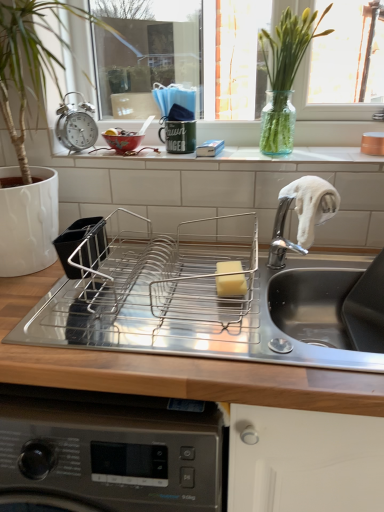
Question: Is there a large distance between matte ceramic bowl at upper left and metallic alarm clock at upper left?

Choices:
 (A) no
 (B) yes

Answer: (A)

Question: From the image's perspective, would you say matte ceramic bowl at upper left is shown under metallic alarm clock at upper left?

Choices:
 (A) yes
 (B) no

Answer: (A)

Question: From a real-world perspective, is matte ceramic bowl at upper left beneath metallic alarm clock at upper left?

Choices:
 (A) yes
 (B) no

Answer: (A)

Question: From the image's perspective, does matte ceramic bowl at upper left appear higher than metallic alarm clock at upper left?

Choices:
 (A) no
 (B) yes

Answer: (A)

Question: Is metallic alarm clock at upper left at the back of matte ceramic bowl at upper left?

Choices:
 (A) yes
 (B) no

Answer: (B)

Question: Is matte ceramic bowl at upper left at the left side of metallic alarm clock at upper left?

Choices:
 (A) yes
 (B) no

Answer: (B)

Question: From a real-world perspective, is yellow sponge at center physically above white ceramic window sill at center?

Choices:
 (A) no
 (B) yes

Answer: (A)

Question: From the image's perspective, is yellow sponge at center over white ceramic window sill at center?

Choices:
 (A) yes
 (B) no

Answer: (B)

Question: Does yellow sponge at center appear on the left side of white ceramic window sill at center?

Choices:
 (A) yes
 (B) no

Answer: (B)

Question: Considering the relative positions of yellow sponge at center and white ceramic window sill at center in the image provided, is yellow sponge at center behind white ceramic window sill at center?

Choices:
 (A) no
 (B) yes

Answer: (A)

Question: Is yellow sponge at center not inside white ceramic window sill at center?

Choices:
 (A) no
 (B) yes

Answer: (B)

Question: From the image's perspective, would you say yellow sponge at center is shown under white ceramic window sill at center?

Choices:
 (A) no
 (B) yes

Answer: (B)

Question: Is metallic alarm clock at upper left taller than stainless steel dish rack at center?

Choices:
 (A) yes
 (B) no

Answer: (B)